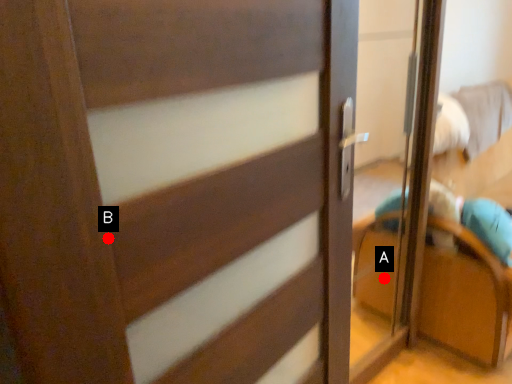
Question: Two points are circled on the image, labeled by A and B beside each circle. Which of the following is the closest to the observer?

Choices:
 (A) A is closer
 (B) B is closer

Answer: (B)